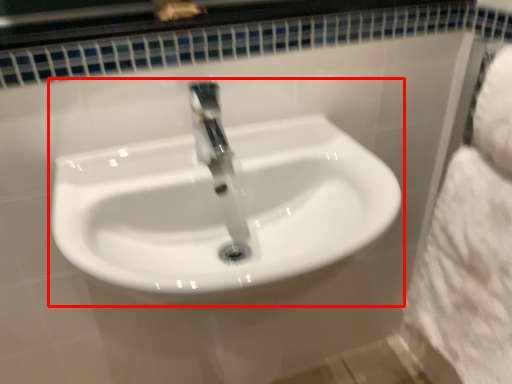
Question: From the image's perspective, where is sink (annotated by the red box) located in relation to bath towel in the image?

Choices:
 (A) below
 (B) above

Answer: (A)